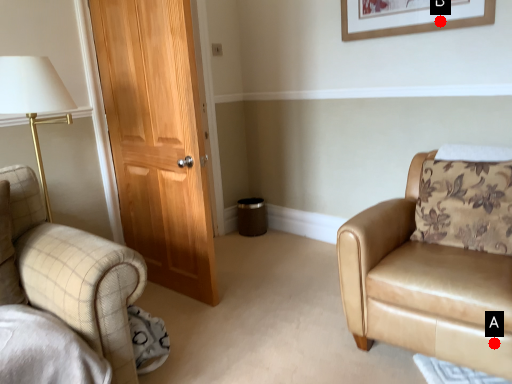
Question: Two points are circled on the image, labeled by A and B beside each circle. Which point is closer to the camera taking this photo?

Choices:
 (A) A is closer
 (B) B is closer

Answer: (A)